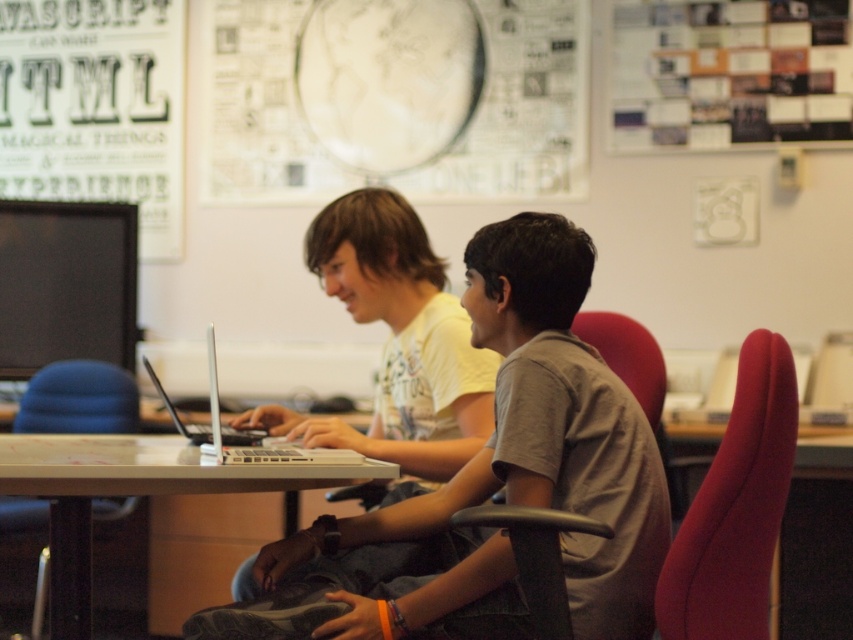
Question: Does light brown shirt at center appear over silver metallic laptop at center?

Choices:
 (A) no
 (B) yes

Answer: (A)

Question: Which of the following is the farthest from the observer?

Choices:
 (A) (726, 433)
 (B) (3, 477)

Answer: (B)

Question: Which object is farther from the camera taking this photo?

Choices:
 (A) blue fabric chair at lower left
 (B) light brown shirt at center
 (C) white glossy table at center

Answer: (A)

Question: Does white glossy table at center have a lesser width compared to blue fabric chair at lower left?

Choices:
 (A) yes
 (B) no

Answer: (B)

Question: Which of the following is the closest to the observer?

Choices:
 (A) silver metallic laptop at center
 (B) white glossy table at center
 (C) light brown shirt at center

Answer: (B)

Question: Does velvet-like red swivel chair at right appear under white glossy table at center?

Choices:
 (A) no
 (B) yes

Answer: (A)